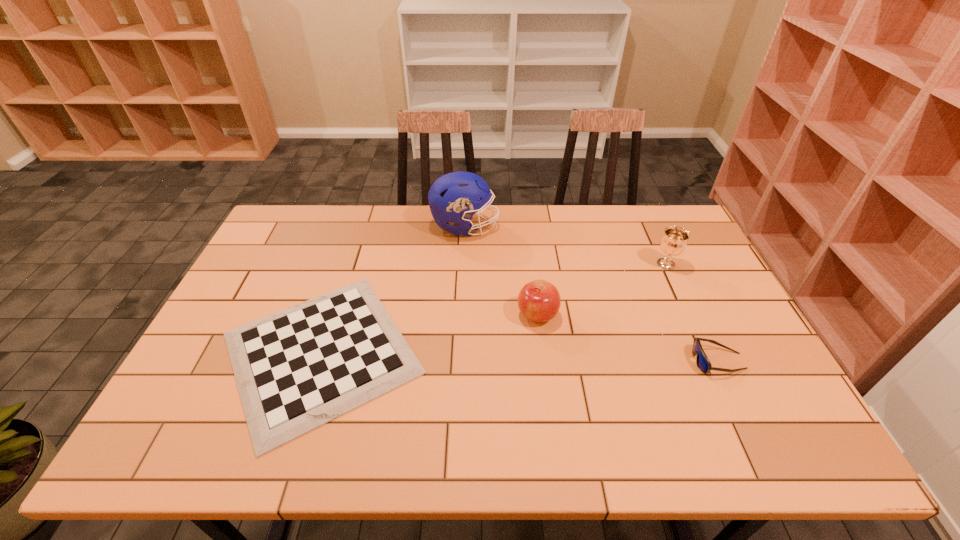
In the image, there is a desktop. Where is `vacant space at the far edge`? vacant space at the far edge is located at coordinates (531, 231).

At what (x,y) coordinates should I click in order to perform the action: click on blank space at the near edge of the desktop. Please return your answer as a coordinate pair (x, y). Image resolution: width=960 pixels, height=540 pixels. Looking at the image, I should click on (243, 444).

You are a GUI agent. You are given a task and a screenshot of the screen. Output one action in this format:
    pyautogui.click(x=<x>, y=<y>)
    Task: Click on the free space at the left edge of the desktop
    The width and height of the screenshot is (960, 540).
    Given the screenshot: What is the action you would take?
    pyautogui.click(x=246, y=290)

In the image, there is a desktop. At what (x,y) coordinates should I click in order to perform the action: click on vacant space at the right edge. Please return your answer as a coordinate pair (x, y). The height and width of the screenshot is (540, 960). Looking at the image, I should click on (704, 301).

In the image, there is a desktop. In order to click on free region at the far left corner in this screenshot , I will do `click(307, 210)`.

Where is `blank space at the near right corner`? The image size is (960, 540). blank space at the near right corner is located at coordinates (795, 429).

You are a GUI agent. You are given a task and a screenshot of the screen. Output one action in this format:
    pyautogui.click(x=<x>, y=<y>)
    Task: Click on the free spot between the second farthest object and the second shortest object
    This screenshot has width=960, height=540.
    Given the screenshot: What is the action you would take?
    pyautogui.click(x=692, y=313)

Locate an element on the screen. The height and width of the screenshot is (540, 960). vacant space that is in between the fourth nearest object and the shortest object is located at coordinates (493, 308).

At what (x,y) coordinates should I click in order to perform the action: click on vacant space that's between the farthest object and the fourth nearest object. Please return your answer as a coordinate pair (x, y). Looking at the image, I should click on (565, 245).

Identify the location of free space between the farthest object and the fourth nearest object. (565, 245).